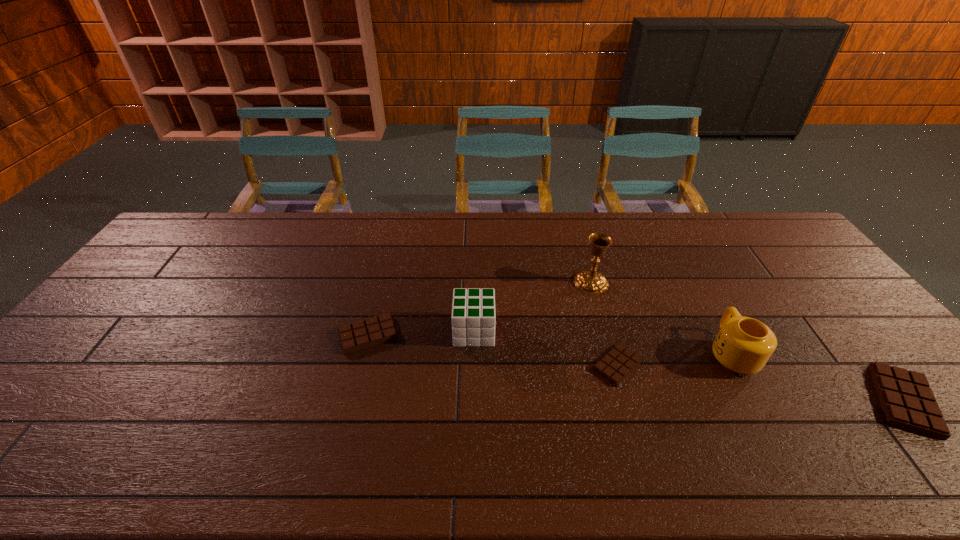
Please point a spot on the left to add another candy bar. Please provide its 2D coordinates. Your answer should be formatted as a tuple, i.e. [(x, y)], where the tuple contains the x and y coordinates of a point satisfying the conditions above.

[(149, 308)]